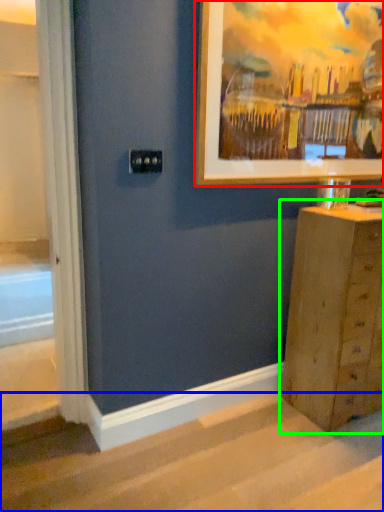
Question: Based on their relative distances, which object is farther from picture frame (highlighted by a red box)? Choose from stairwell (highlighted by a blue box) and chest of drawers (highlighted by a green box).

Choices:
 (A) stairwell
 (B) chest of drawers

Answer: (A)